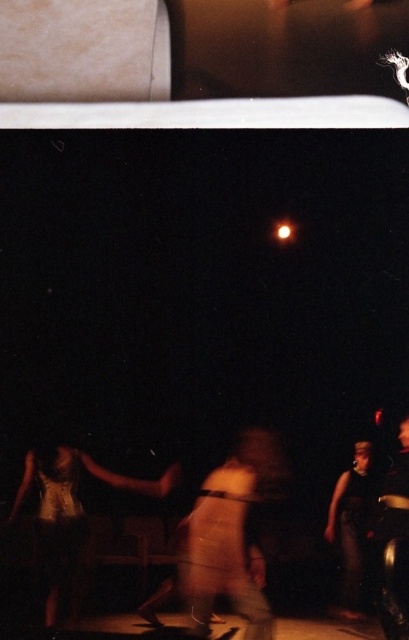
Question: Does smooth beige pants at center have a smaller size compared to gold metallic dress at lower left?

Choices:
 (A) yes
 (B) no

Answer: (A)

Question: Can you confirm if gold metallic dress at lower left is thinner than dark gray fabric at lower right?

Choices:
 (A) yes
 (B) no

Answer: (B)

Question: Which object is the farthest from the dark gray fabric at lower right?

Choices:
 (A) smooth beige pants at center
 (B) gold metallic dress at lower left

Answer: (B)

Question: Which object is farther from the camera taking this photo?

Choices:
 (A) gold metallic dress at lower left
 (B) dark gray fabric at lower right
 (C) smooth beige pants at center

Answer: (A)

Question: Which object is positioned closest to the dark gray fabric at lower right?

Choices:
 (A) smooth beige pants at center
 (B) gold metallic dress at lower left

Answer: (A)

Question: Can you confirm if gold metallic dress at lower left is positioned below dark gray fabric at lower right?

Choices:
 (A) no
 (B) yes

Answer: (A)